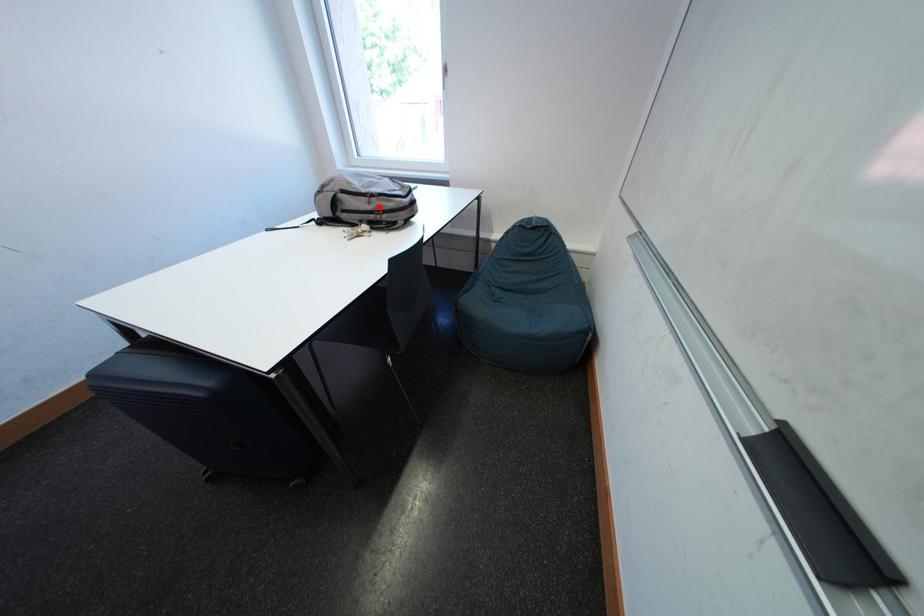
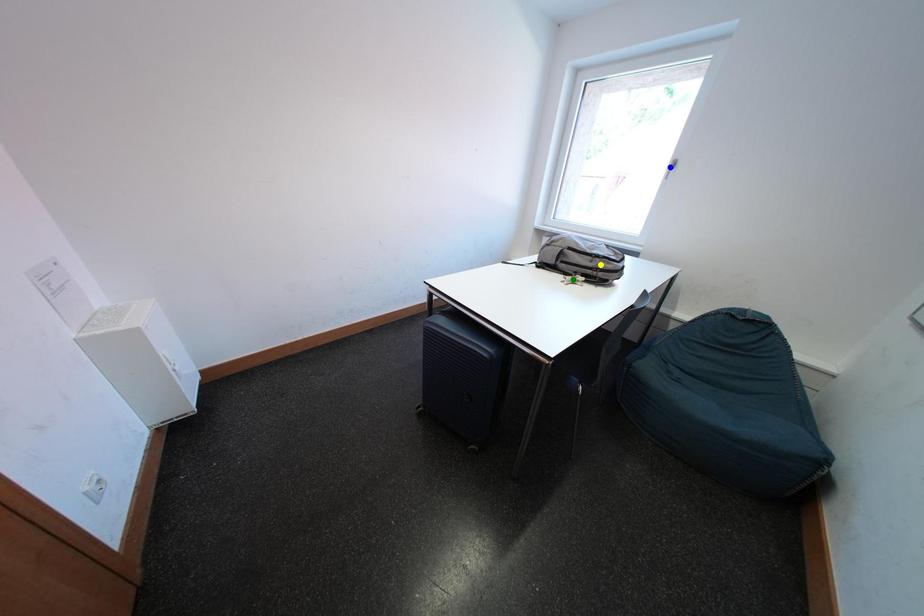
Question: I am providing you with two images of the same scene from different viewpoints. A red point is marked on the first image. You are given multiple points on the second image. Which point in image 2 is actually the same real-world point as the red point in image 1?

Choices:
 (A) green point
 (B) yellow point
 (C) blue point

Answer: (B)